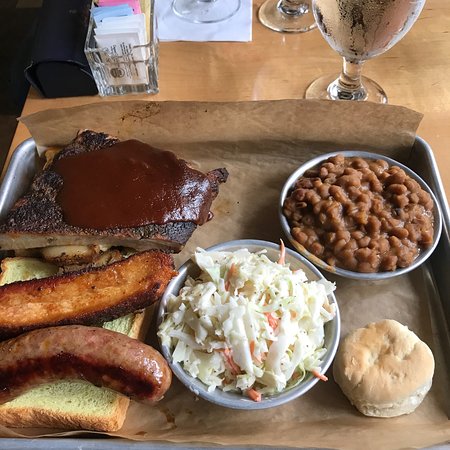
Identify the location of bowl full of beans. (362, 198).